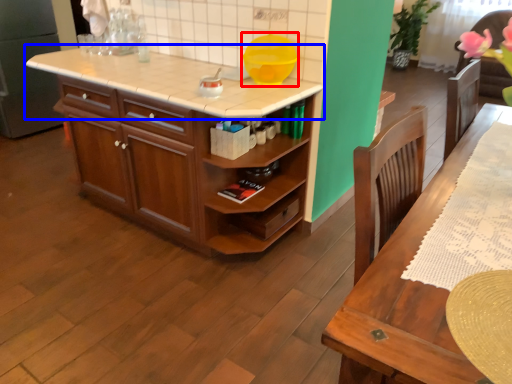
Question: Which of the following is the farthest to the observer, appliance (highlighted by a red box) or countertop (highlighted by a blue box)?

Choices:
 (A) appliance
 (B) countertop

Answer: (A)